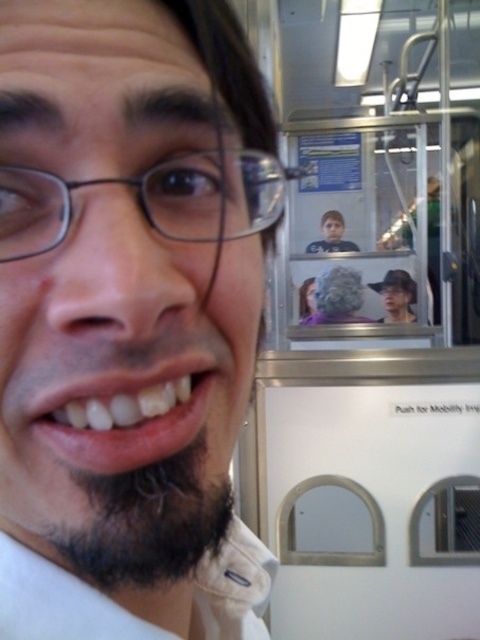
Consider the image. You are a photographer trying to capture a closeup of the person in the image. The matte black glasses at upper left and white glossy teeth at lower center are both in focus. If you want to adjust your camera to focus on an object that is closer to you than the glasses, which object should you choose?

The white glossy teeth at lower center are closer to you than the matte black glasses at upper left, so you should focus on the white glossy teeth at lower center.

You are a photographer trying to capture a closeup shot of the person in the scene. You need to ensure that both the white matte face at center and the white glossy teeth at lower center are clearly visible in the frame. Based on their spatial relationship, which object should you focus on first to ensure both are in focus?

Since the white matte face at center might be wider than white glossy teeth at lower center, focusing on the white matte face at center first would help ensure both are in focus as it has a larger area to work with.

You are standing on a public transportation vehicle and want to place a small sticker exactly at point (2,125). Considering the distance from your eyes to this point is 8.50 inches, can you estimate if you can reach it comfortably with your hand?

The distance of point (2,125) from viewer is 8.50 inches, so yes, you can comfortably reach it with your hand as 8.50 inches is within typical comfortable hand reach distance.